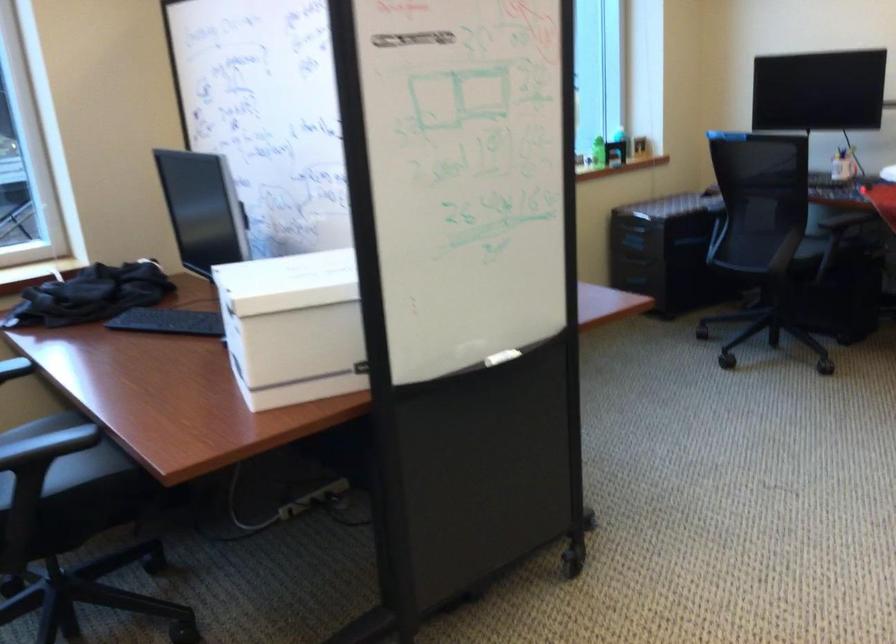
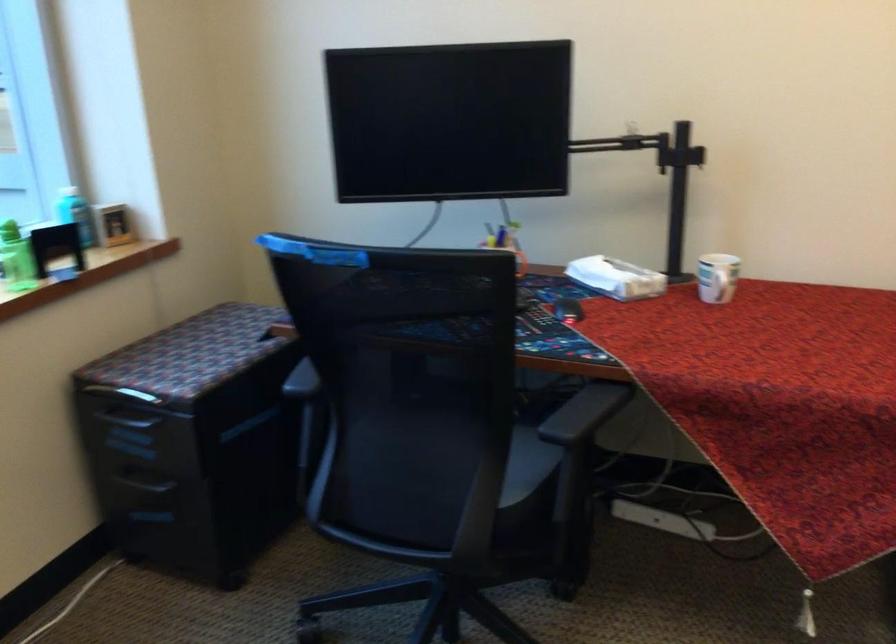
Where in the second image is the point corresponding to point 719,194 from the first image?

(302, 380)